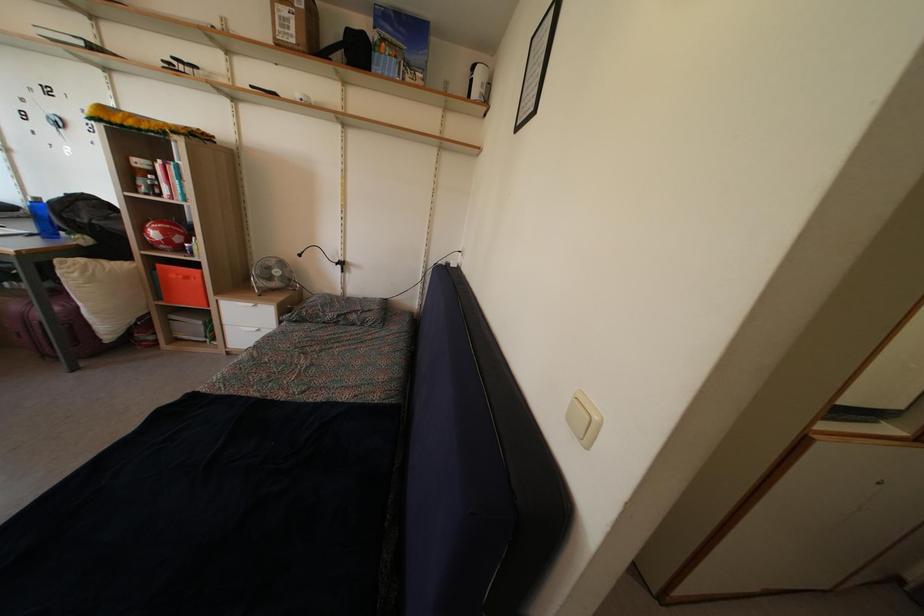
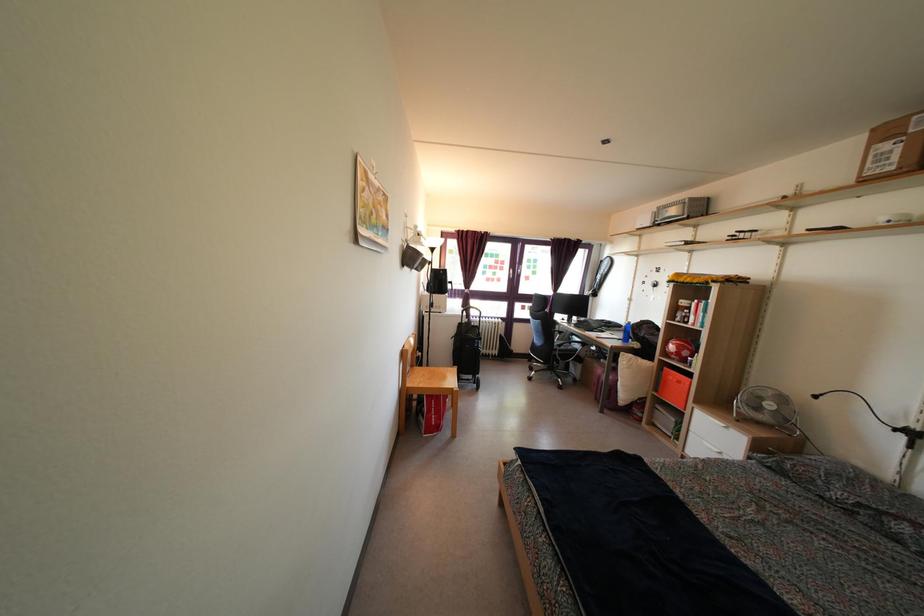
Question: The camera is either moving clockwise (left) or counter-clockwise (right) around the object. The first image is from the beginning of the video and the second image is from the end. Is the camera moving left or right when shooting the video?

Choices:
 (A) Left
 (B) Right

Answer: (B)